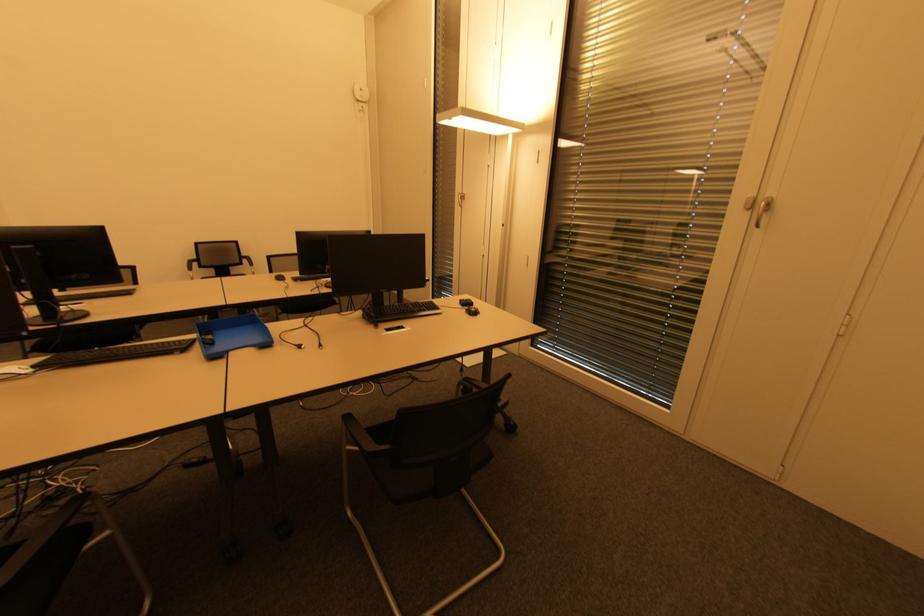
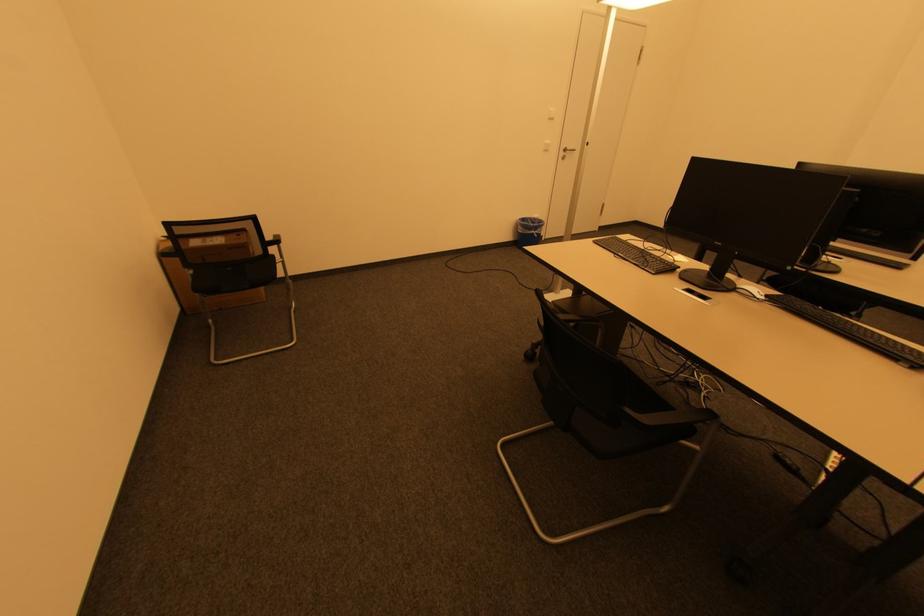
First-person continuous shooting, in which direction is the camera rotating?

The rotation direction of the camera is left-down.